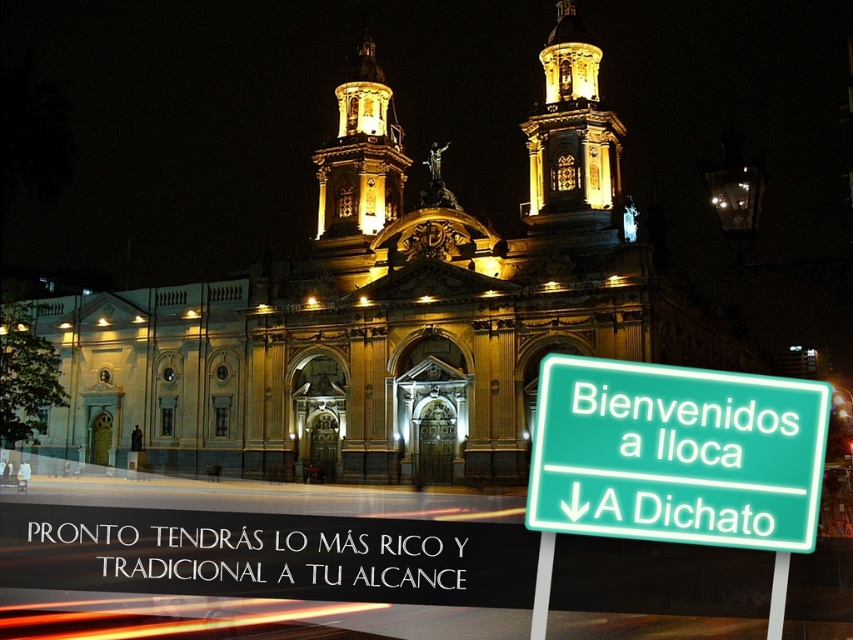
You are standing at point A located at coordinates point A at (727, 497). You want to walk to point B, which is 127.43 feet away from point A. Given the scene described, what is the most likely landmark you will pass near as you walk from point A to point B?

The most likely landmark you will pass near is the illuminated building, as it is the most prominent structure in the scene and the distance between the points suggests a path leading towards it.